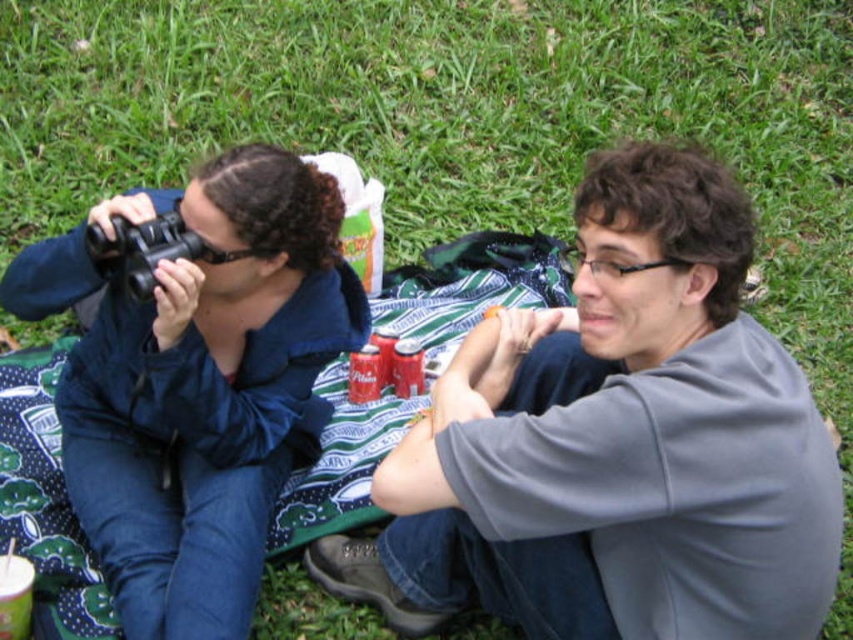
Looking at this image, you are standing in the scene and want to place a marker at the exact center of the image. The coordinates of the center are at point 0.5, 0.5. Where is the matte black binoculars at left located relative to the center?

The matte black binoculars at left is located to the left and slightly below the center of the image since its coordinates are at point (196, 381), which is closer to the left side and lower than the center point (426, 320).

You are a photographer trying to capture a clear image of the person on the left. Which binoculars are closer to the camera, the matte black binoculars at left or the black plastic binoculars at upper left?

The black plastic binoculars at upper left are closer to the camera because they are positioned above the matte black binoculars at left.